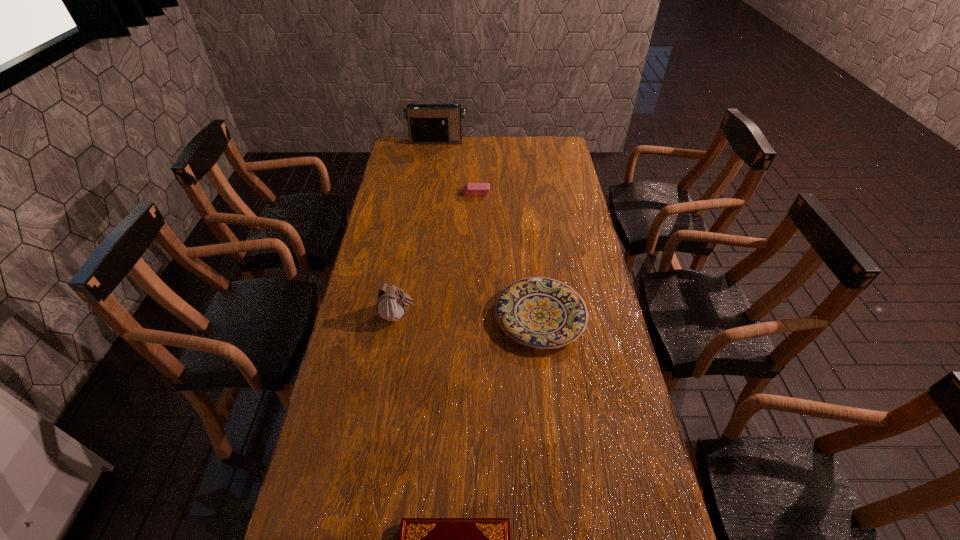
At what (x,y) coordinates should I click in order to perform the action: click on the tallest object. Please return your answer as a coordinate pair (x, y). This screenshot has height=540, width=960. Looking at the image, I should click on (427, 123).

I want to click on radio receiver, so click(427, 123).

Identify the location of the second tallest object. (392, 302).

In order to click on the second farthest object in this screenshot , I will do `click(471, 189)`.

Find the location of a particular element. plate is located at coordinates (543, 313).

At what (x,y) coordinates should I click in order to perform the action: click on free space located on the front-facing side of the radio receiver. Please return your answer as a coordinate pair (x, y). The width and height of the screenshot is (960, 540). Looking at the image, I should click on (434, 159).

You are a GUI agent. You are given a task and a screenshot of the screen. Output one action in this format:
    pyautogui.click(x=<x>, y=<y>)
    Task: Click on the vacant space situated on the front-facing side of the fourth shortest object
    Image resolution: width=960 pixels, height=540 pixels.
    Given the screenshot: What is the action you would take?
    click(x=514, y=315)

You are a GUI agent. You are given a task and a screenshot of the screen. Output one action in this format:
    pyautogui.click(x=<x>, y=<y>)
    Task: Click on the vacant space located 0.050m on the front of the fourth nearest object
    
    Given the screenshot: What is the action you would take?
    pyautogui.click(x=476, y=203)

What are the coordinates of `vacant space located on the left of the plate` in the screenshot? It's located at (459, 316).

Identify the location of object that is at the far edge. Image resolution: width=960 pixels, height=540 pixels. (427, 123).